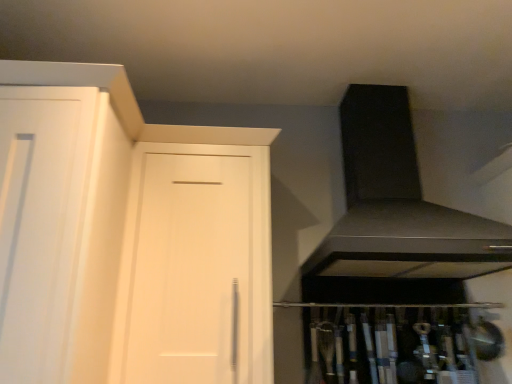
Question: Is satin black exhaust hood at upper right in front of or behind white matte door at center in the image?

Choices:
 (A) behind
 (B) front

Answer: (B)

Question: Would you say satin black exhaust hood at upper right is to the left or to the right of white matte door at center in the picture?

Choices:
 (A) right
 (B) left

Answer: (A)

Question: Considering the positions of satin black exhaust hood at upper right and white matte door at center in the image, is satin black exhaust hood at upper right wider or thinner than white matte door at center?

Choices:
 (A) wide
 (B) thin

Answer: (A)

Question: Relative to satin black exhaust hood at upper right, is white matte door at center in front or behind?

Choices:
 (A) behind
 (B) front

Answer: (A)

Question: From their relative heights in the image, would you say white matte door at center is taller or shorter than satin black exhaust hood at upper right?

Choices:
 (A) tall
 (B) short

Answer: (A)

Question: Is white matte door at center spatially inside satin black exhaust hood at upper right, or outside of it?

Choices:
 (A) inside
 (B) outside

Answer: (B)

Question: From the image's perspective, is white matte door at center located above or below satin black exhaust hood at upper right?

Choices:
 (A) below
 (B) above

Answer: (A)